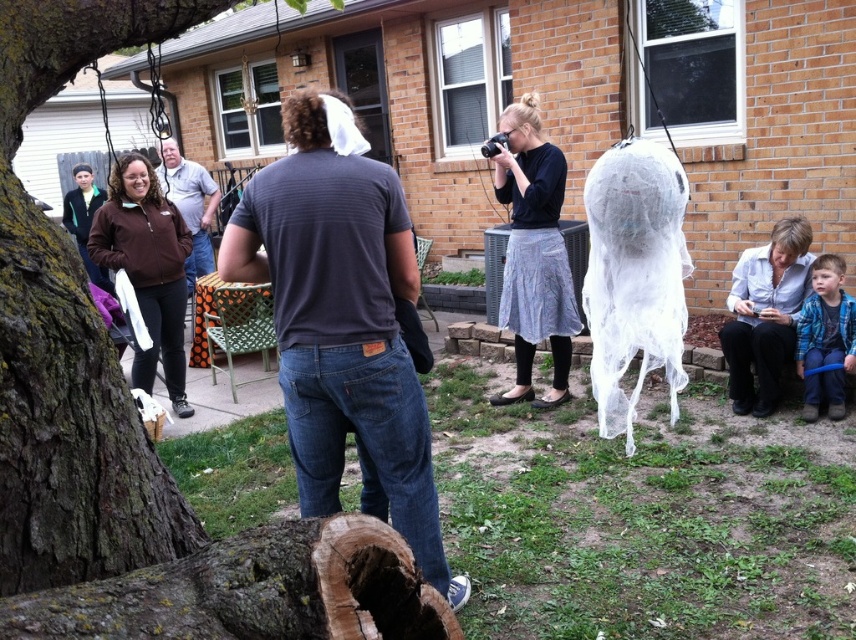
You are attending a backyard gathering and notice two people wearing the white lace dress at lower right and the brown fabric shirt at center. Which person is standing closer to the front of the scene?

The white lace dress at lower right is positioned under the brown fabric shirt at center, meaning the person wearing the white lace dress at lower right is standing closer to the front of the scene.